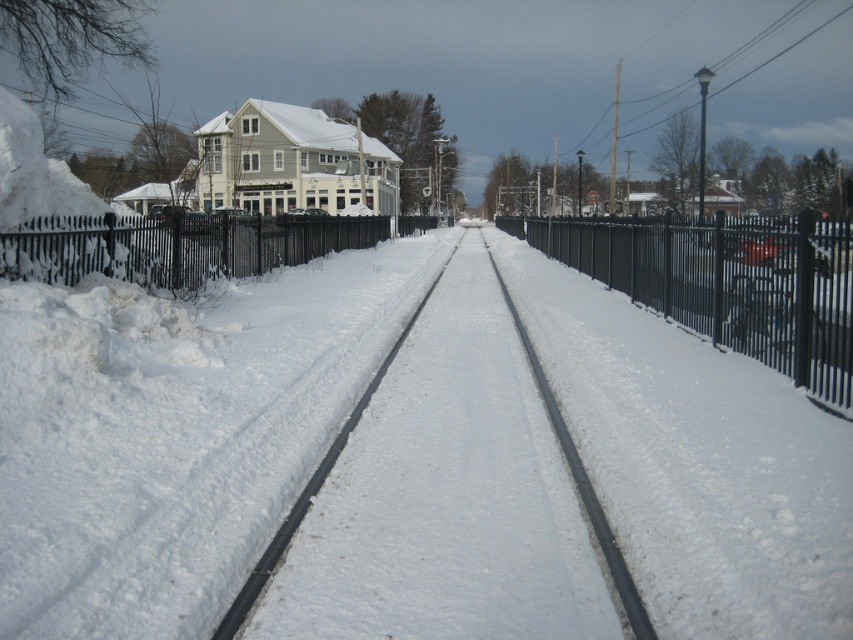
You are standing on the snowy railway tracks and looking towards the large building. Which fence, the black metal fence at center or the black wrought iron fence at left, is closer to you?

The black metal fence at center is closer to you because it is positioned below the black wrought iron fence at left, meaning it is in front of the latter from your viewpoint.